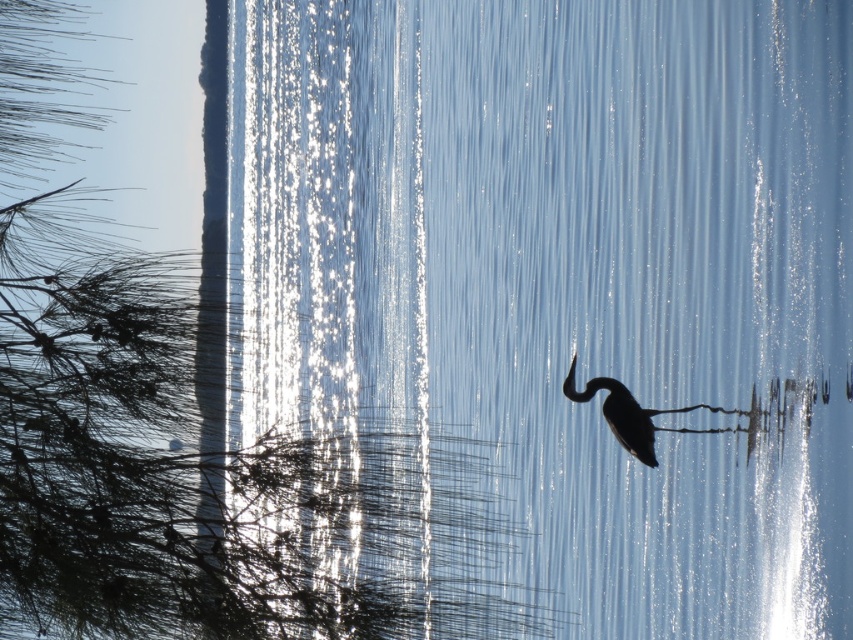
How much distance is there between green leafy tree at upper left and silhouette matte bird at center?

A: The distance of green leafy tree at upper left from silhouette matte bird at center is 9.84 meters.

Is green leafy tree at upper left taller than silhouette matte bird at center?

Yes, green leafy tree at upper left is taller than silhouette matte bird at center.

Locate an element on the screen. The image size is (853, 640). green leafy tree at upper left is located at coordinates (392, 337).